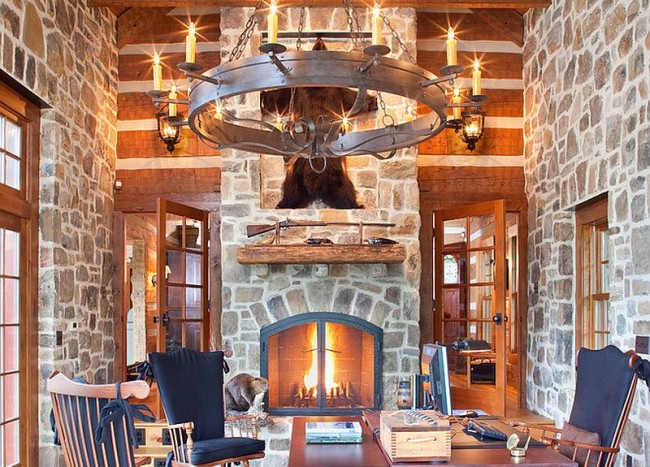
At what (x,y) coordinates should I click in order to perform the action: click on stone fireplace. Please return your answer as a coordinate pair (x, y). Looking at the image, I should click on tap(364, 297), tap(227, 206).